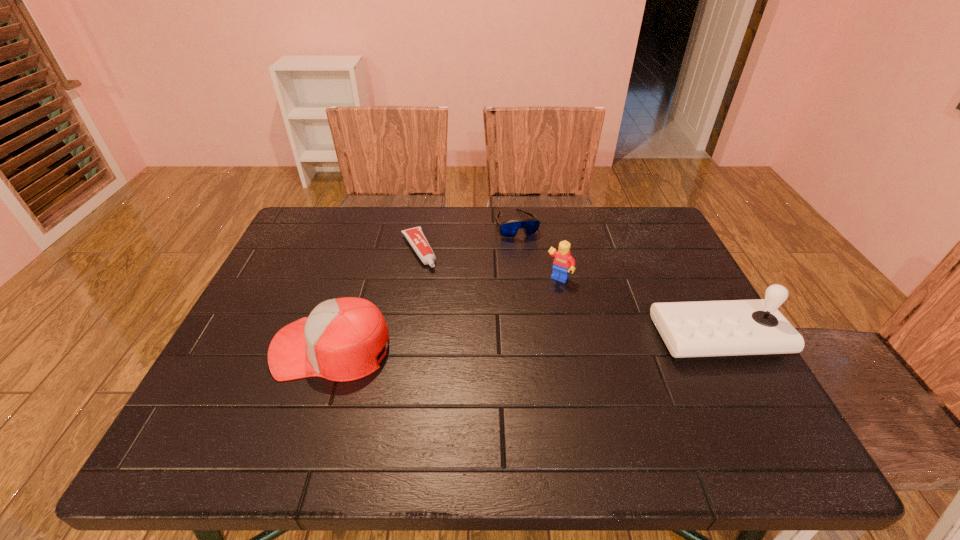
Locate an element on the screen. The height and width of the screenshot is (540, 960). object that is at the near edge is located at coordinates (340, 340).

This screenshot has height=540, width=960. Identify the location of object present at the left edge. (340, 340).

At what (x,y) coordinates should I click in order to perform the action: click on object situated at the right edge. Please return your answer as a coordinate pair (x, y). Image resolution: width=960 pixels, height=540 pixels. Looking at the image, I should click on (732, 329).

Find the location of a particular element. This screenshot has width=960, height=540. object located at the near left corner is located at coordinates (340, 340).

Locate an element on the screen. The height and width of the screenshot is (540, 960). vacant region at the far edge of the desktop is located at coordinates (473, 250).

In order to click on vacant space at the near edge of the desktop in this screenshot , I will do `click(314, 412)`.

In the image, there is a desktop. Where is `blank space at the right edge`? This screenshot has height=540, width=960. blank space at the right edge is located at coordinates (629, 265).

This screenshot has height=540, width=960. In order to click on vacant space at the far left corner of the desktop in this screenshot , I will do `click(326, 212)`.

Image resolution: width=960 pixels, height=540 pixels. In order to click on blank space at the far right corner of the desktop in this screenshot , I will do `click(614, 231)`.

Image resolution: width=960 pixels, height=540 pixels. I want to click on free space between the sunglasses and the toothpaste, so click(468, 237).